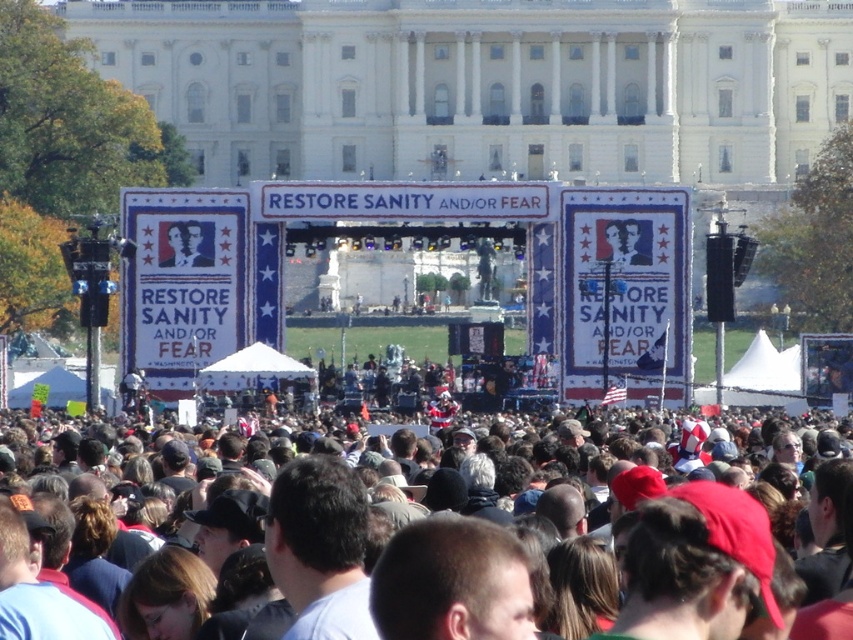
Question: Is dark brown hair at center wider than matte black portrait at center?

Choices:
 (A) no
 (B) yes

Answer: (B)

Question: Which object is farther from the camera taking this photo?

Choices:
 (A) dark brown hair at center
 (B) matte black portrait at center

Answer: (B)

Question: Is dark brown hair at center thinner than matte black portrait at center?

Choices:
 (A) yes
 (B) no

Answer: (B)

Question: Observing the image, what is the correct spatial positioning of dark brown hair at center in reference to matte black portrait at center?

Choices:
 (A) left
 (B) right

Answer: (B)